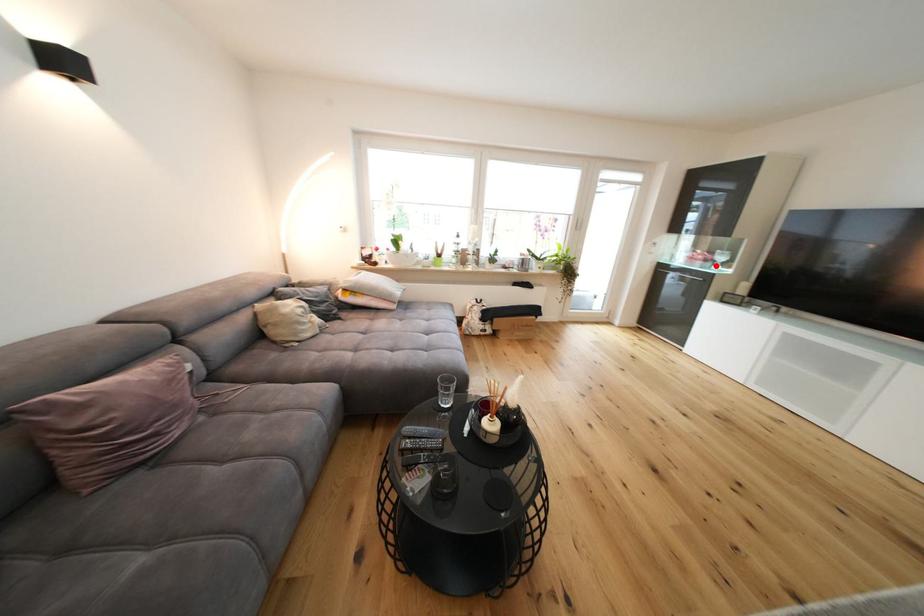
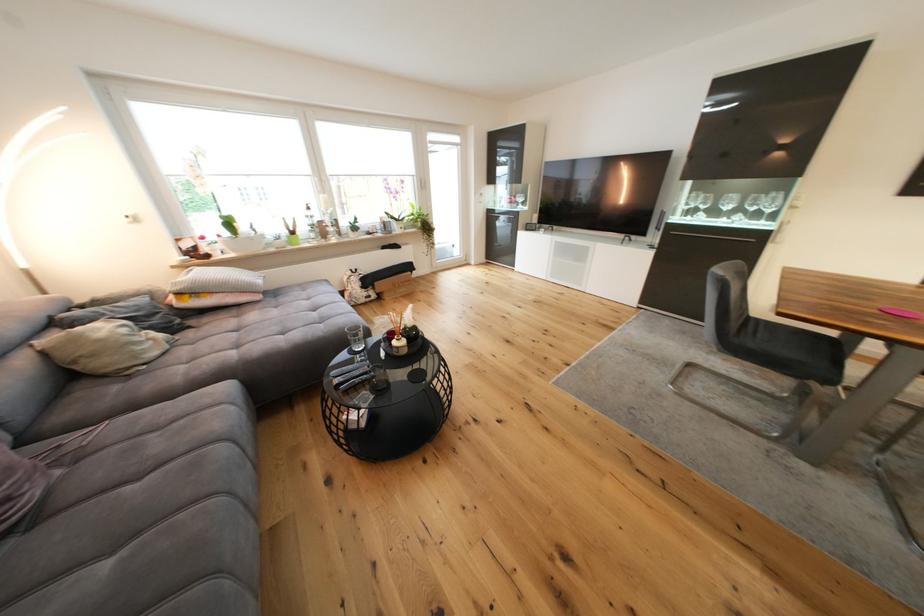
Question: I am providing you with two images of the same scene from different viewpoints. Given a red point in image1, look at the same physical point in image2. Is it:

Choices:
 (A) Closer to the viewpoint
 (B) Farther from the viewpoint

Answer: (A)